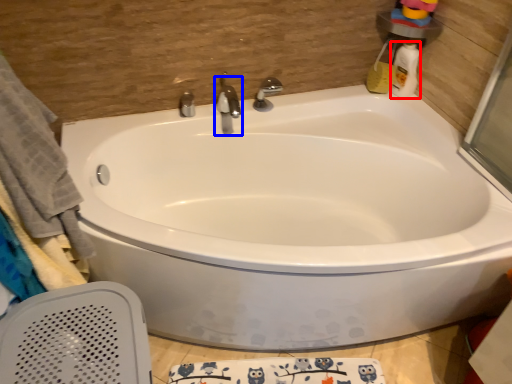
Question: Which of the following is the farthest to the observer, cleaning product (highlighted by a red box) or tap (highlighted by a blue box)?

Choices:
 (A) cleaning product
 (B) tap

Answer: (A)